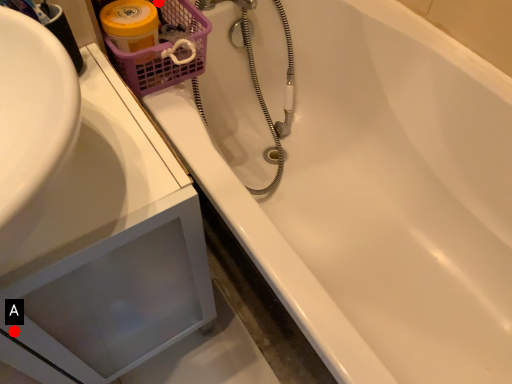
Question: Two points are circled on the image, labeled by A and B beside each circle. Which point appears closest to the camera in this image?

Choices:
 (A) A is closer
 (B) B is closer

Answer: (A)